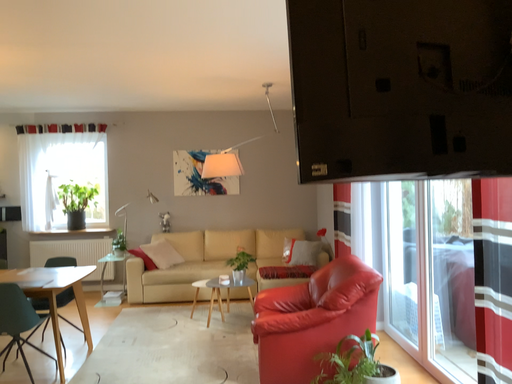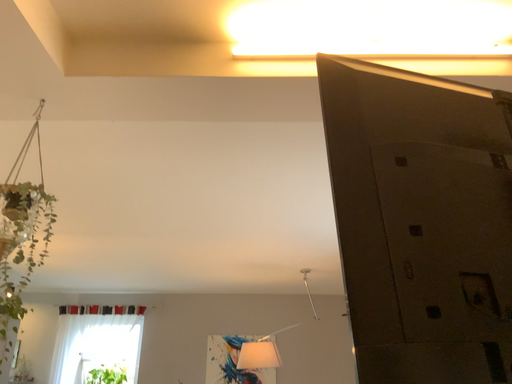
Question: Which way did the camera rotate in the video?

Choices:
 (A) rotated upward
 (B) rotated downward

Answer: (A)